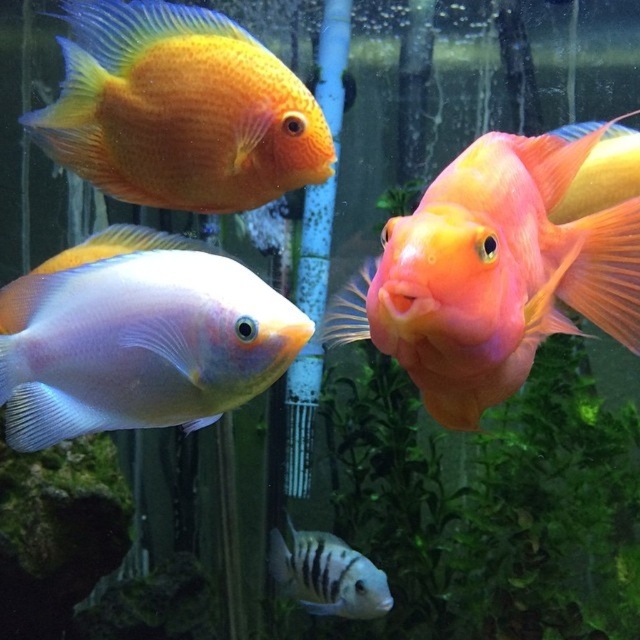
Question: Is shiny orange fish at center wider than black striped fish at lower center?

Choices:
 (A) no
 (B) yes

Answer: (A)

Question: Which point is closer to the camera?

Choices:
 (A) shiny orange fish at upper center
 (B) shiny orange fish at center

Answer: (B)

Question: Does shiny orange fish at center appear on the left side of shiny orange fish at upper center?

Choices:
 (A) yes
 (B) no

Answer: (B)

Question: Which is farther from the translucent white fish at center?

Choices:
 (A) shiny orange fish at center
 (B) black striped fish at lower center

Answer: (B)

Question: Which object is positioned closest to the black striped fish at lower center?

Choices:
 (A) translucent white fish at center
 (B) shiny orange fish at upper center

Answer: (A)

Question: Can you confirm if shiny orange fish at center is smaller than black striped fish at lower center?

Choices:
 (A) no
 (B) yes

Answer: (B)